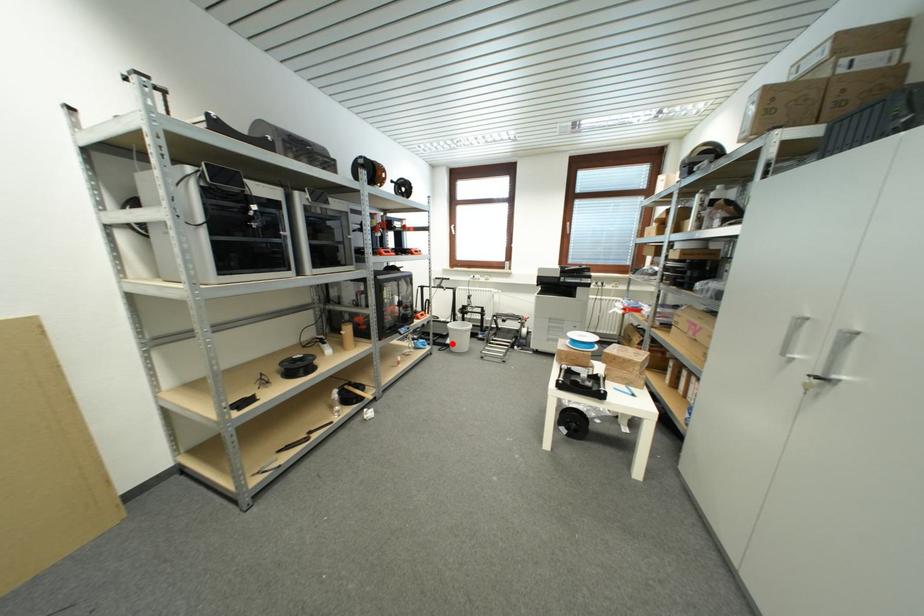
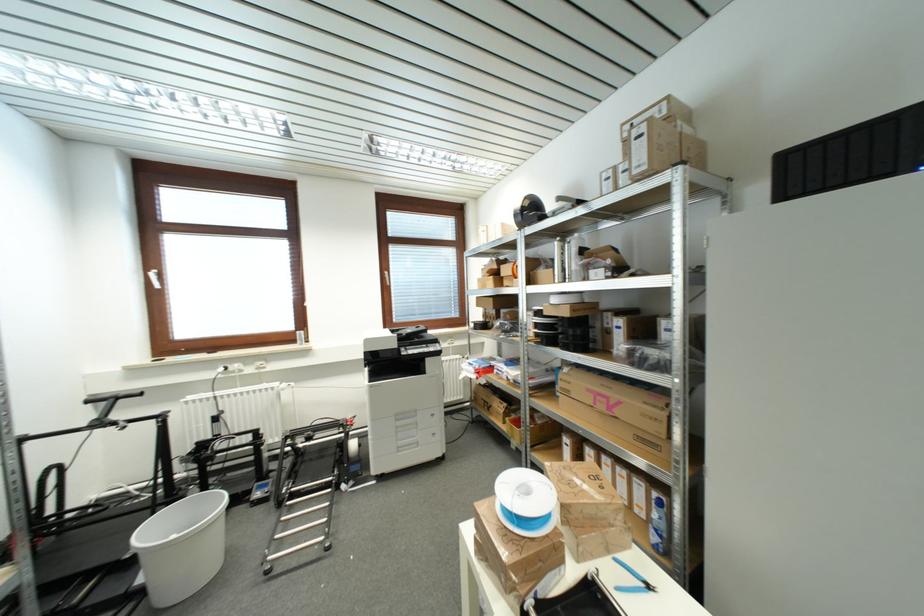
The point at the highlighted location is marked in the first image. Where is the corresponding point in the second image?

(144, 582)